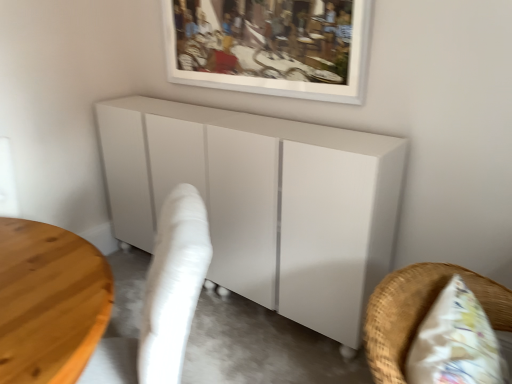
Question: Is white glossy cabinet at center, the 1th furniture positioned from the back, to the left or to the right of white wicker chair at lower right, positioned as the 2th furniture in back-to-front order, in the image?

Choices:
 (A) right
 (B) left

Answer: (B)

Question: In terms of height, does white glossy cabinet at center, the 1th furniture positioned from the back, look taller or shorter compared to white wicker chair at lower right, positioned as the 2th furniture in back-to-front order?

Choices:
 (A) tall
 (B) short

Answer: (A)

Question: Which object is the farthest from the white matte picture frame at upper center?

Choices:
 (A) white fabric swivel chair at lower left
 (B) white glossy cabinet at center, the 1th furniture positioned from the back
 (C) white wicker chair at lower right, the first furniture from the front

Answer: (C)

Question: Which of these objects is positioned closest to the white glossy cabinet at center, the 1th furniture positioned from the back?

Choices:
 (A) white fabric swivel chair at lower left
 (B) white wicker chair at lower right, the first furniture from the front
 (C) white matte picture frame at upper center

Answer: (C)